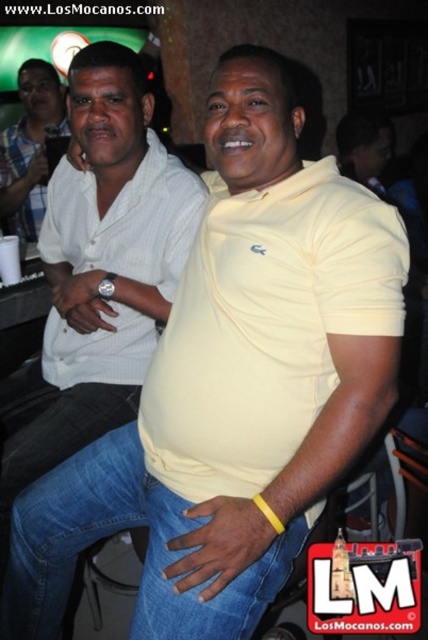
Is the position of blue denim jeans at center less distant than that of matte white shirt at left?

Yes, blue denim jeans at center is in front of matte white shirt at left.

Is blue denim jeans at center bigger than matte white shirt at left?

Incorrect, blue denim jeans at center is not larger than matte white shirt at left.

Between point (9, 614) and point (15, 138), which one is positioned in front?

Point (9, 614) is more forward.

Image resolution: width=428 pixels, height=640 pixels. I want to click on blue denim jeans at center, so click(112, 532).

Between point (101, 150) and point (148, 588), which one is positioned behind?

Point (101, 150)

Which of these two, white matte shirt at center or blue denim jeans at center, stands shorter?

blue denim jeans at center

You are a GUI agent. You are given a task and a screenshot of the screen. Output one action in this format:
    pyautogui.click(x=<x>, y=<y>)
    Task: Click on the white matte shirt at center
    
    Given the screenshot: What is the action you would take?
    pyautogui.click(x=103, y=266)

Is white matte shirt at center shorter than matte white shirt at left?

In fact, white matte shirt at center may be taller than matte white shirt at left.

Describe the element at coordinates (103, 266) in the screenshot. I see `white matte shirt at center` at that location.

Which is in front, point (127, 372) or point (36, 221)?

Positioned in front is point (127, 372).

This screenshot has height=640, width=428. I want to click on white matte shirt at center, so [103, 266].